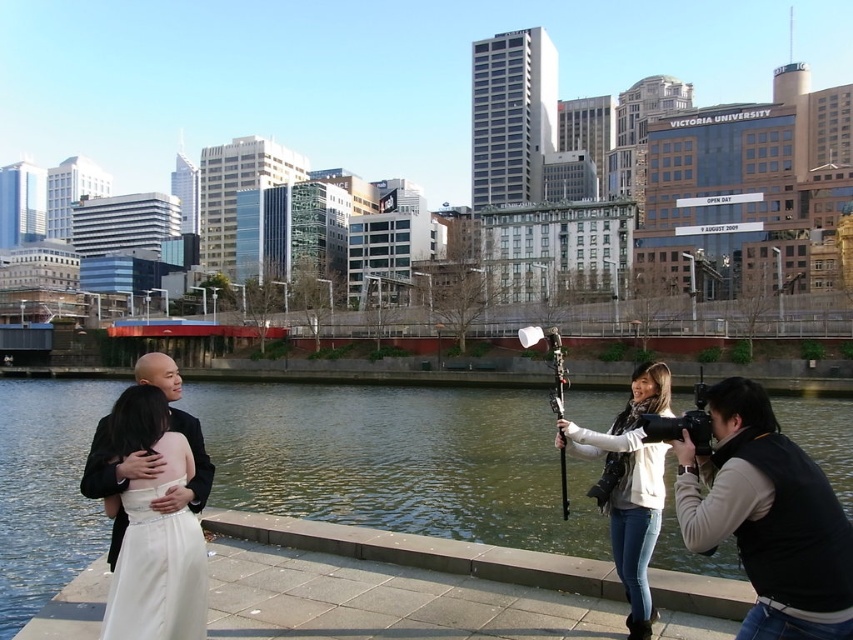
Does point (392, 492) lie behind point (766, 396)?

That is True.

Which of these two, greenish water at center or black vest at lower right, stands taller?

Standing taller between the two is black vest at lower right.

Which is behind, point (271, 486) or point (822, 563)?

The point (271, 486) is more distant.

This screenshot has height=640, width=853. In order to click on greenish water at center in this screenshot , I will do `click(397, 460)`.

Between point (650, 524) and point (151, 516), which one is positioned in front?

Point (151, 516) is more forward.

Which is behind, point (659, 445) or point (163, 600)?

The point (659, 445) is more distant.

The image size is (853, 640). In order to click on white matte jacket at lower right in this screenshot , I will do `click(630, 484)`.

Who is more distant from viewer, (473, 452) or (171, 627)?

Point (473, 452)

Between greenish water at center and white satin dress at lower left, which one is positioned higher?

white satin dress at lower left is higher up.

Does point (41, 406) come closer to viewer compared to point (190, 636)?

No, it is not.

Find the location of a particular element. greenish water at center is located at coordinates (397, 460).